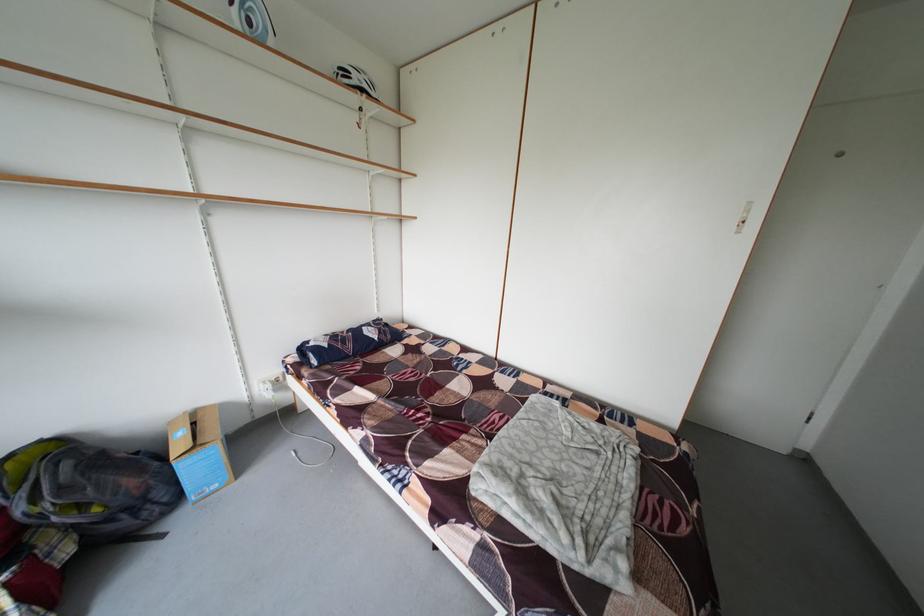
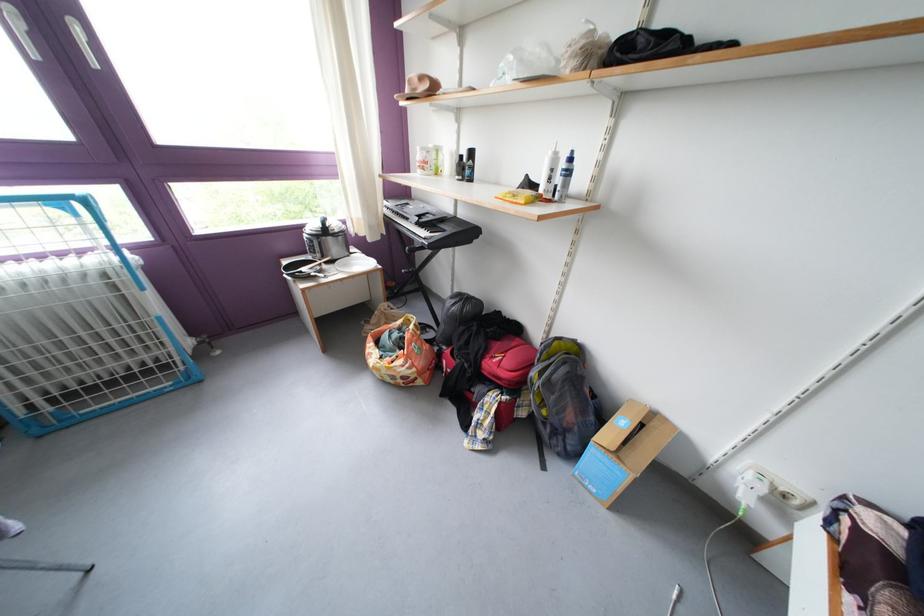
Find the pixel in the second image that matches (31,515) in the first image.

(543, 379)